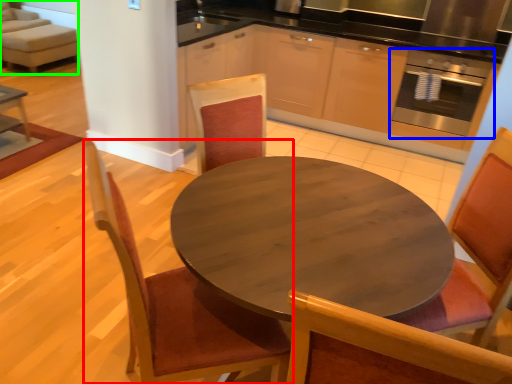
Question: Which object is the closest to the chair (highlighted by a red box)? Choose among these: oven (highlighted by a blue box) or couch (highlighted by a green box).

Choices:
 (A) oven
 (B) couch

Answer: (A)